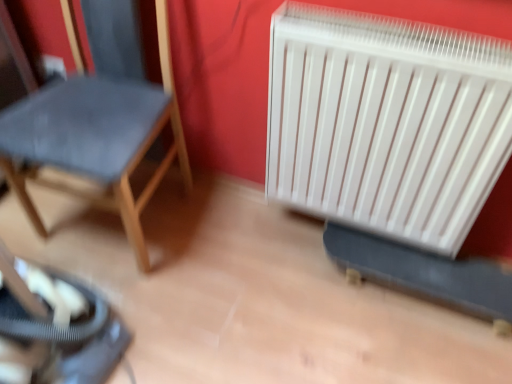
Find the location of a particular element. vacant space underneath velvet blue chair at left (from a real-world perspective) is located at coordinates (141, 220).